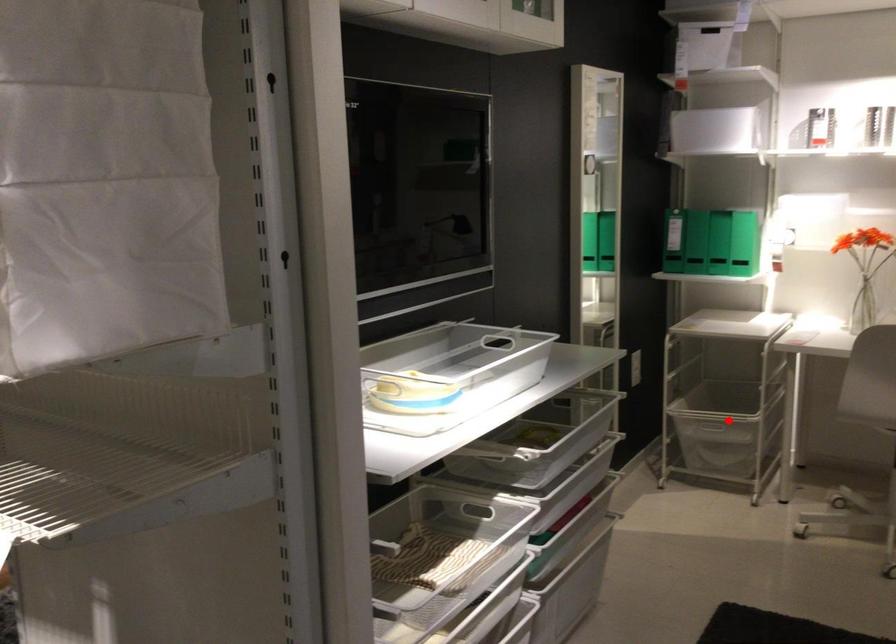
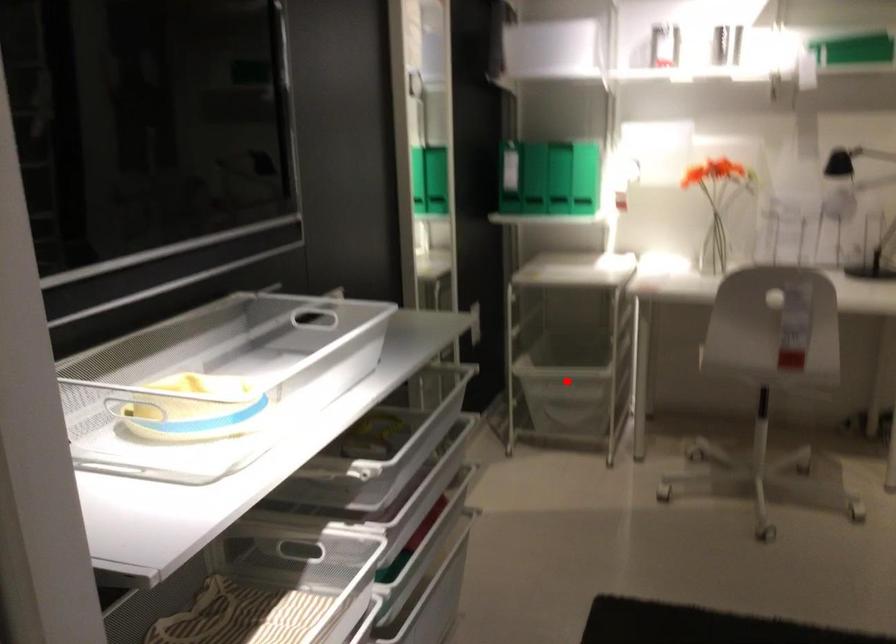
I am providing you with two images of the same scene from different viewpoints. A red point is marked on the first image and another point is marked on the second image. Are the points marked in image1 and image2 representing the same 3D position?

Yes